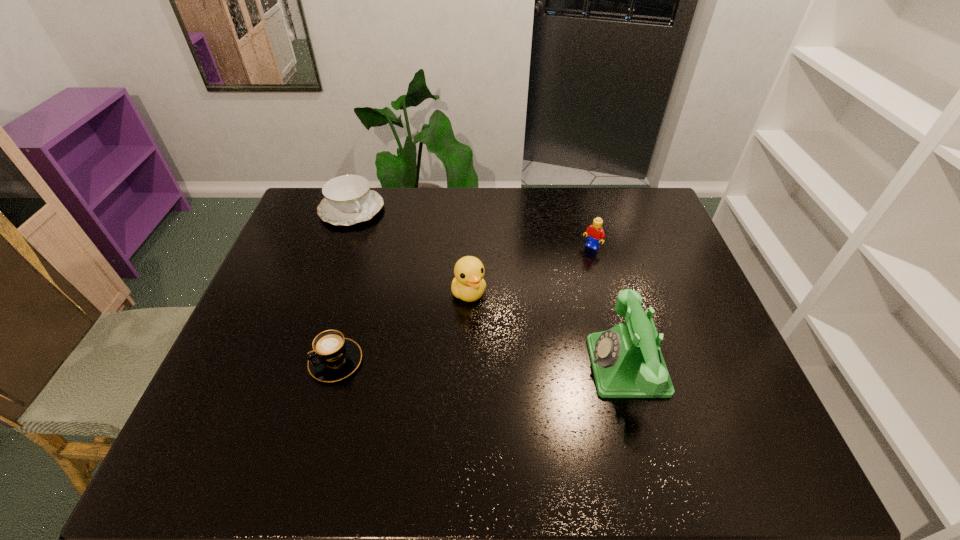
Find the location of a particular element. free region located on the dial of the telephone is located at coordinates pos(550,366).

The height and width of the screenshot is (540, 960). Find the location of `vacant area situated on the face of the second tallest object`. vacant area situated on the face of the second tallest object is located at coordinates (483, 324).

I want to click on free space located on the face of the second tallest object, so click(x=499, y=356).

Identify the location of free space located on the face of the second tallest object. This screenshot has width=960, height=540. pyautogui.click(x=502, y=362).

Locate an element on the screen. Image resolution: width=960 pixels, height=540 pixels. vacant position located 0.080m on the handle side of the chinaware is located at coordinates (373, 239).

Find the location of a particular element. The height and width of the screenshot is (540, 960). vacant space situated 0.060m on the handle side of the chinaware is located at coordinates (372, 235).

You are a GUI agent. You are given a task and a screenshot of the screen. Output one action in this format:
    pyautogui.click(x=<x>, y=<y>)
    Task: Click on the vacant space situated on the handle side of the chinaware
    
    Given the screenshot: What is the action you would take?
    pyautogui.click(x=395, y=267)

Find the location of a particular element. The image size is (960, 540). vacant area situated on the front-facing side of the third shortest object is located at coordinates (566, 273).

This screenshot has height=540, width=960. In order to click on free location located 0.310m on the front-facing side of the third shortest object in this screenshot , I will do `click(531, 310)`.

You are a GUI agent. You are given a task and a screenshot of the screen. Output one action in this format:
    pyautogui.click(x=<x>, y=<y>)
    Task: Click on the free space located 0.060m on the front-facing side of the third shortest object
    
    Given the screenshot: What is the action you would take?
    pyautogui.click(x=577, y=262)